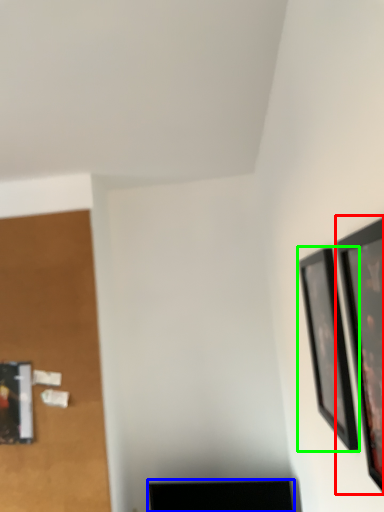
Question: Estimate the real-world distances between objects in this image. Which object is closer to picture frame (highlighted by a red box), furniture (highlighted by a blue box) or picture frame (highlighted by a green box)?

Choices:
 (A) furniture
 (B) picture frame

Answer: (B)